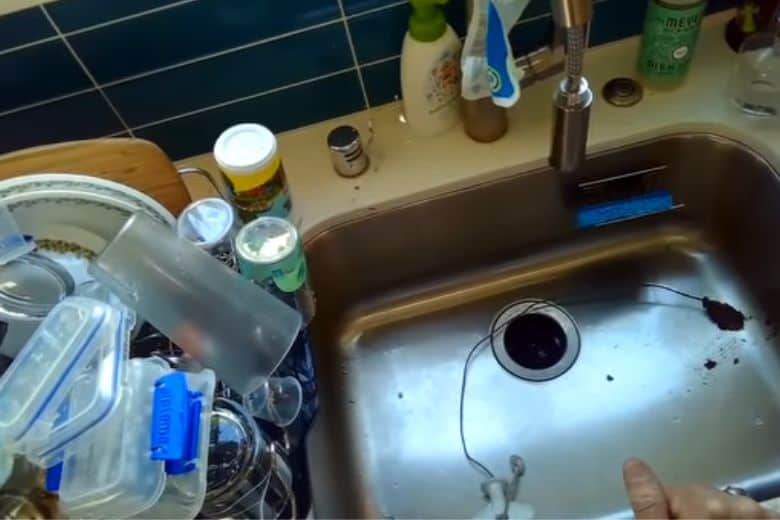
Locate an element on the screen. drain is located at coordinates (522, 322).